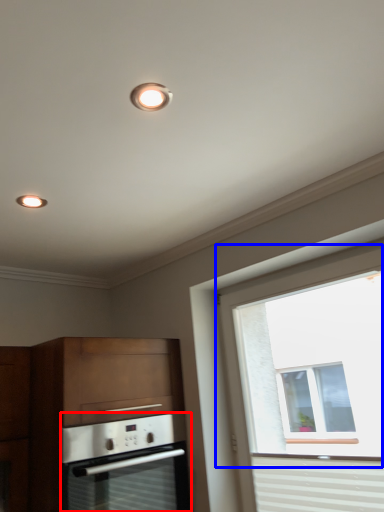
Question: Among these objects, which one is farthest to the camera, oven (highlighted by a red box) or window (highlighted by a blue box)?

Choices:
 (A) oven
 (B) window

Answer: (A)